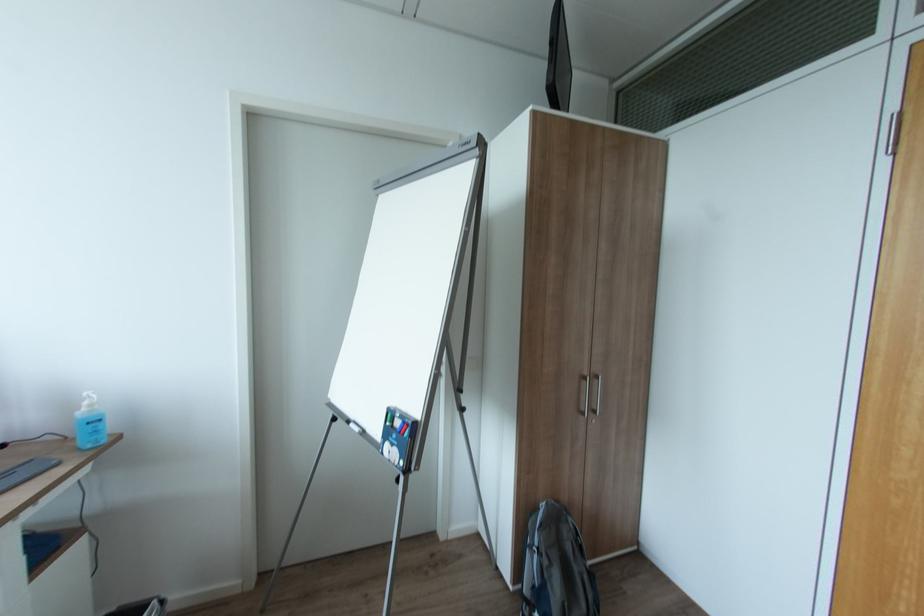
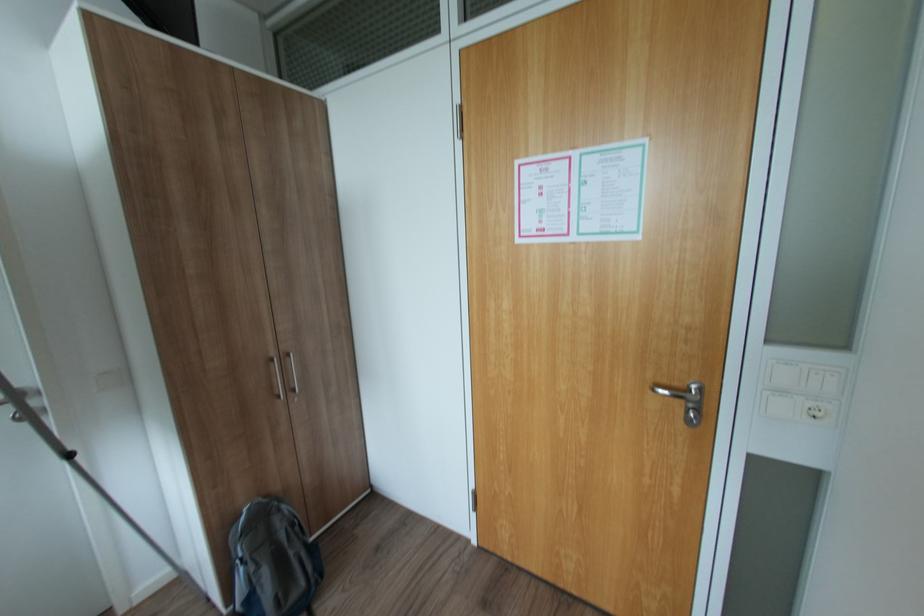
The point at (596, 414) is marked in the first image. Where is the corresponding point in the second image?

(297, 392)